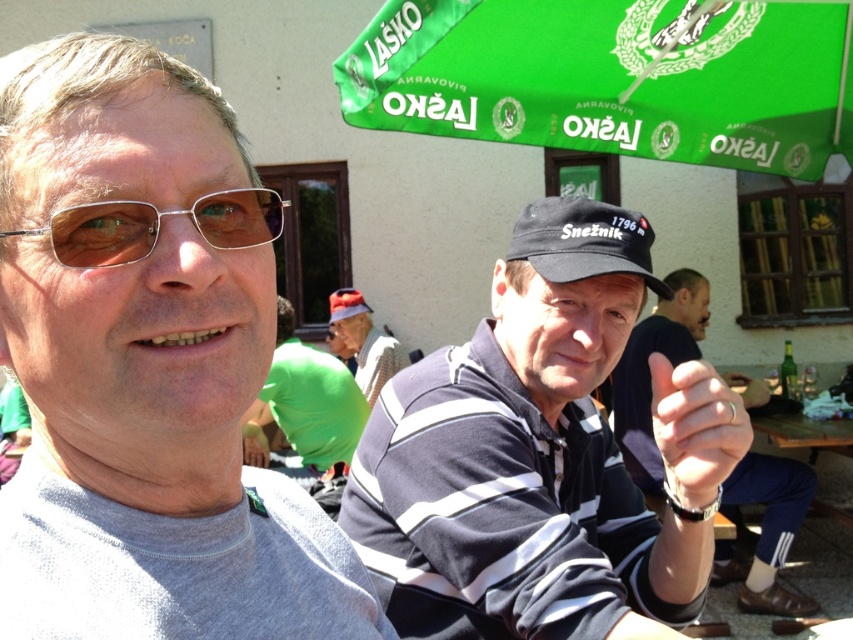
You are a photographer trying to capture both the black matte cap at center and the red fabric baseball cap at center in a single frame. Which cap should you focus on first to ensure both are in the frame?

The black matte cap at center is larger than the red fabric baseball cap at center, so focusing on the larger black matte cap at center first will ensure both are included in the frame.

You are a photographer trying to capture both the black matte cap at center and the red fabric baseball cap at center in a single frame. Based on their positions, which cap should you focus on first to ensure both are in the frame?

The black matte cap at center is located below the red fabric baseball cap at center, so you should focus on the red fabric baseball cap at center first to ensure both are in the frame.